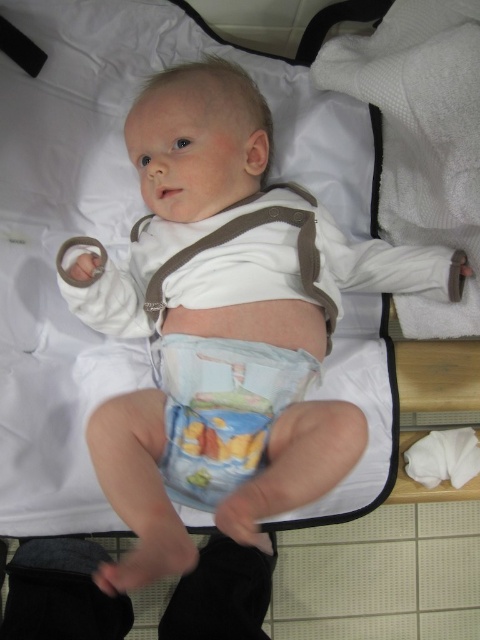
Question: Can you confirm if blue printed fabric diaper at center is positioned to the right of white cotton bib at center?

Choices:
 (A) no
 (B) yes

Answer: (A)

Question: Among these objects, which one is farthest from the camera?

Choices:
 (A) white cotton bib at center
 (B) blue printed fabric diaper at center

Answer: (A)

Question: Which object appears farthest from the camera in this image?

Choices:
 (A) blue printed fabric diaper at center
 (B) white cotton bib at center

Answer: (B)

Question: Which point is closer to the camera?

Choices:
 (A) pyautogui.click(x=235, y=401)
 (B) pyautogui.click(x=240, y=220)

Answer: (A)

Question: Does blue printed fabric diaper at center appear over white cotton bib at center?

Choices:
 (A) yes
 (B) no

Answer: (B)

Question: Is blue printed fabric diaper at center below white cotton bib at center?

Choices:
 (A) no
 (B) yes

Answer: (B)